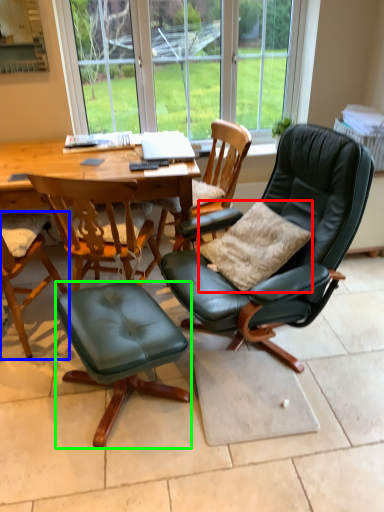
Question: Which is farther away from pillow (highlighted by a red box)? chair (highlighted by a blue box) or stool (highlighted by a green box)?

Choices:
 (A) chair
 (B) stool

Answer: (A)